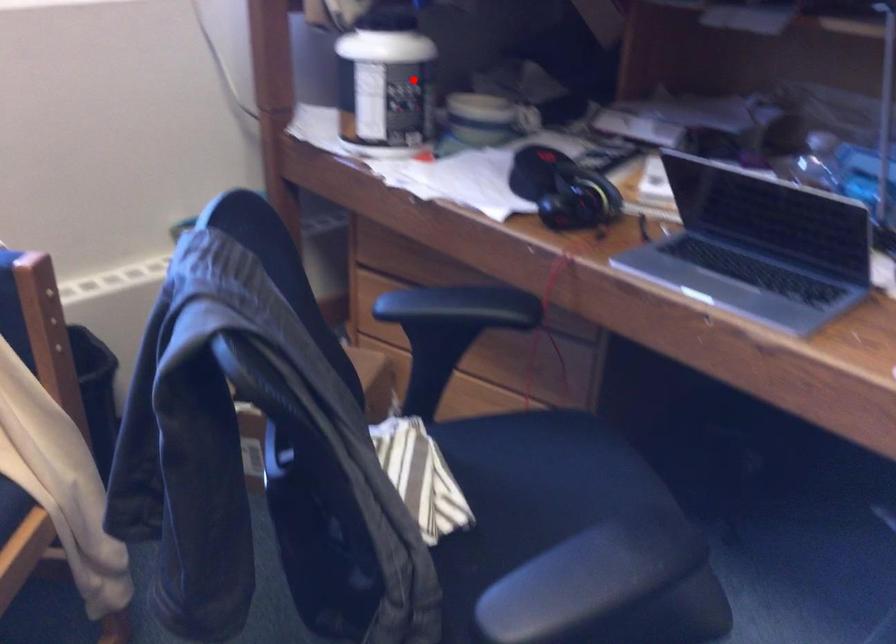
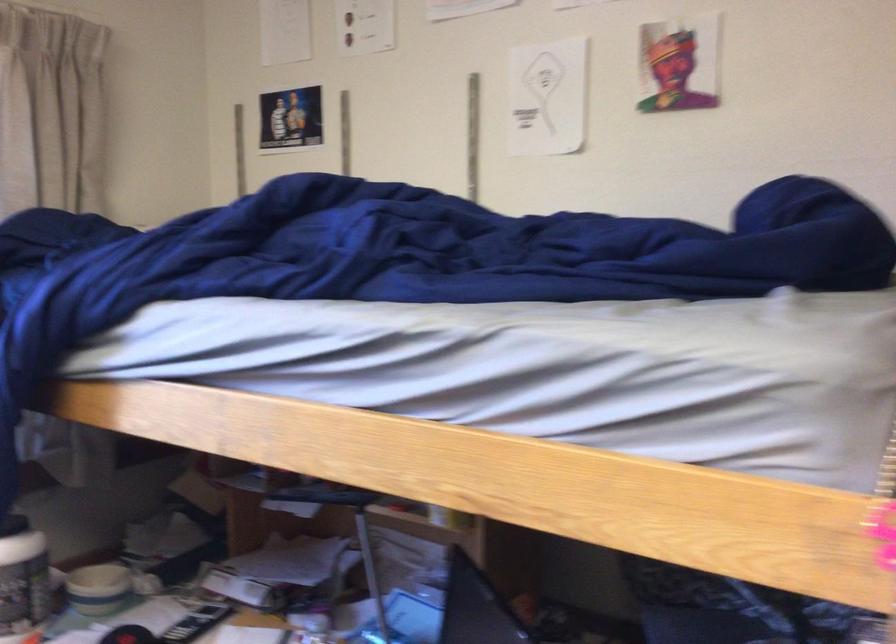
Question: I am providing you with two images of the same scene from different viewpoints. In image1, a red point is highlighted. Considering the same 3D point in image2, which of the following is correct?

Choices:
 (A) It is closer
 (B) It is farther

Answer: (B)